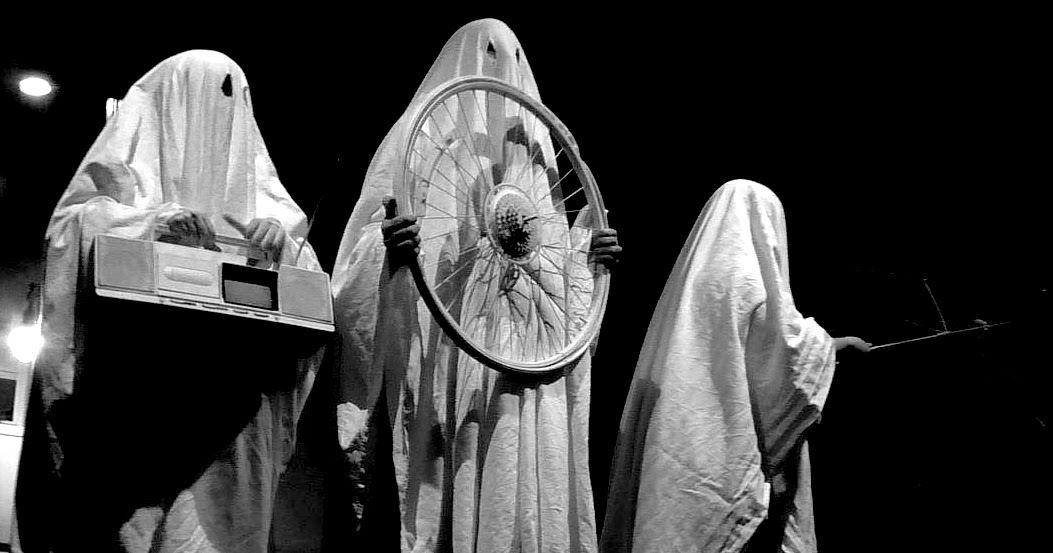
Image resolution: width=1053 pixels, height=553 pixels. I want to click on boombox, so click(121, 296).